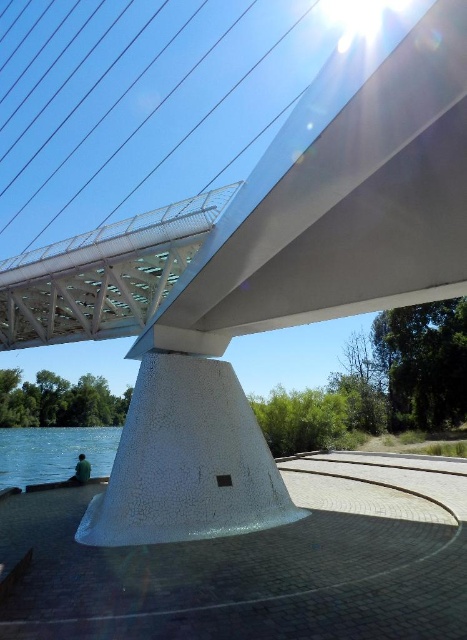
You are a photographer standing on the bridge deck and see the blue water at lower left and the dark green fabric at lower left. Which one appears larger in the scene?

The blue water at lower left is bigger than dark green fabric at lower left, so the blue water at lower left appears larger in the scene.

Based on the photo, you are standing on the bridge and notice the blue water at lower left and the dark green fabric at lower left. Which one appears higher from your viewpoint?

The blue water at lower left is taller than dark green fabric at lower left, so from your viewpoint on the bridge, the blue water at lower left appears higher than the dark green fabric at lower left.

You are standing on the bridge and see the blue water at lower left and the dark green fabric at lower left. Which object is closer to your left side?

The blue water at lower left is positioned on the left side of dark green fabric at lower left, so it is closer to your left side.